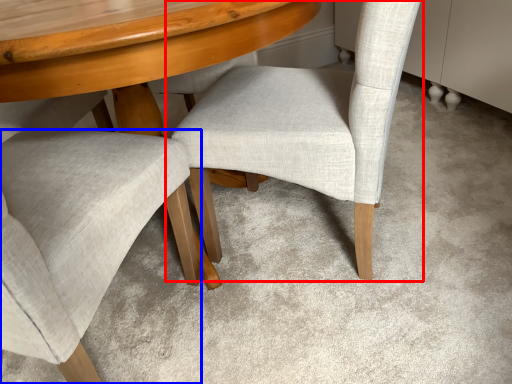
Question: Which point is further to the camera, chair (highlighted by a red box) or chair (highlighted by a blue box)?

Choices:
 (A) chair
 (B) chair

Answer: (A)